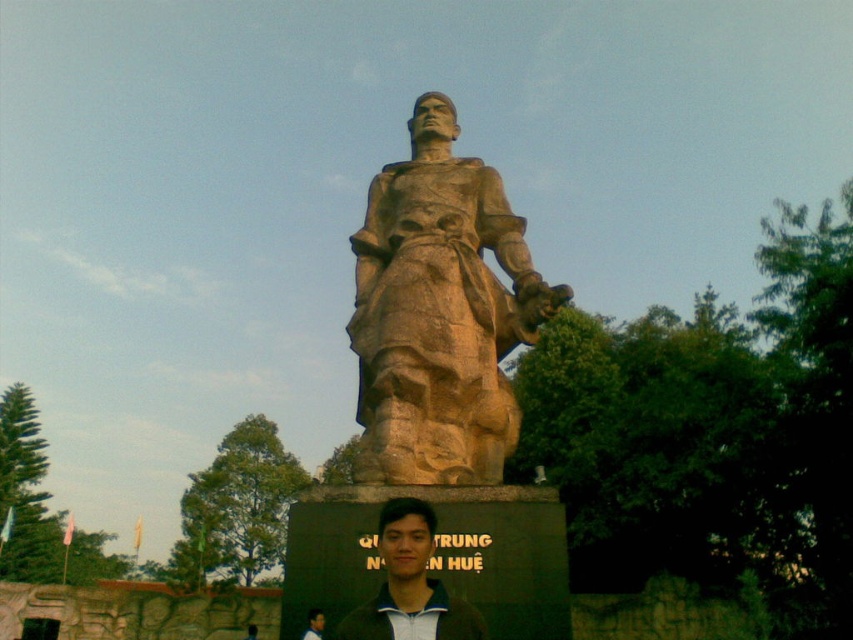
Is point (445, 308) in front of point (370, 625)?

No.

Where is `brown stone statue at center`? The width and height of the screenshot is (853, 640). brown stone statue at center is located at coordinates (439, 312).

Identify the location of brown stone statue at center. The image size is (853, 640). (439, 312).

From the picture: How far apart are dark brown leather jacket at lower center and dark green hair at center?

The distance of dark brown leather jacket at lower center from dark green hair at center is 6.77 meters.

Who is higher up, dark brown leather jacket at lower center or dark green hair at center?

dark brown leather jacket at lower center is above.

You are a GUI agent. You are given a task and a screenshot of the screen. Output one action in this format:
    pyautogui.click(x=<x>, y=<y>)
    Task: Click on the dark brown leather jacket at lower center
    The width and height of the screenshot is (853, 640).
    Given the screenshot: What is the action you would take?
    pyautogui.click(x=410, y=584)

Identify the location of dark brown leather jacket at lower center. This screenshot has width=853, height=640. (410, 584).

Is brown stone statue at center taller than dark green hair at center?

Correct, brown stone statue at center is much taller as dark green hair at center.

Does brown stone statue at center appear on the right side of dark green hair at center?

Correct, you'll find brown stone statue at center to the right of dark green hair at center.

Measure the distance between point (436, 250) and camera.

49.32 meters

You are a GUI agent. You are given a task and a screenshot of the screen. Output one action in this format:
    pyautogui.click(x=<x>, y=<y>)
    Task: Click on the brown stone statue at center
    The height and width of the screenshot is (640, 853).
    Given the screenshot: What is the action you would take?
    pyautogui.click(x=439, y=312)